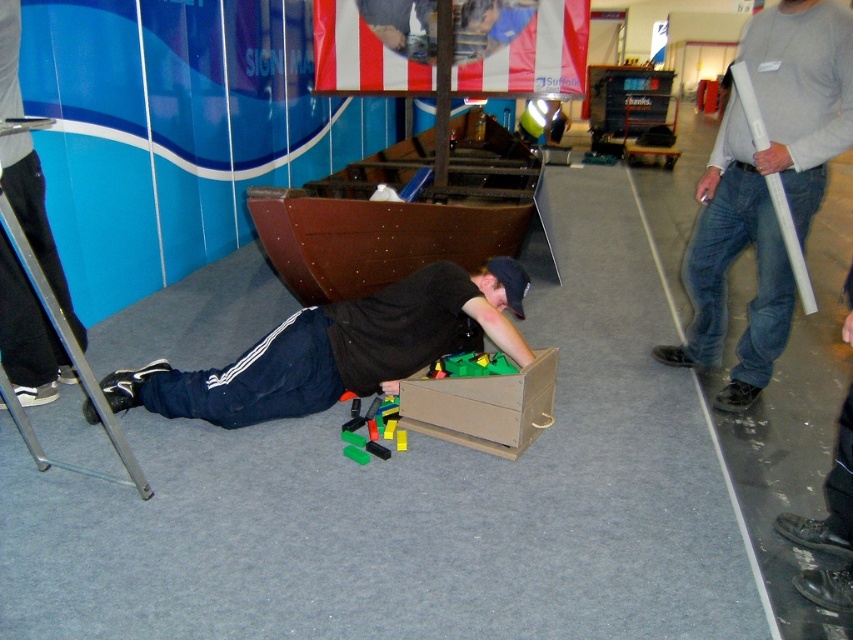
Question: Which object appears closest to the camera in this image?

Choices:
 (A) black leather shoes at lower right
 (B) green plastic blocks at center

Answer: (A)

Question: Which point is farther to the camera?

Choices:
 (A) (345, 422)
 (B) (378, 304)
 (C) (828, 516)

Answer: (B)

Question: Does black matte shirt at center have a lesser width compared to green plastic blocks at center?

Choices:
 (A) no
 (B) yes

Answer: (A)

Question: Is black matte shirt at center smaller than green plastic blocks at center?

Choices:
 (A) no
 (B) yes

Answer: (A)

Question: Observing the image, what is the correct spatial positioning of brown cardboard box at center in reference to green plastic blocks at center?

Choices:
 (A) left
 (B) right

Answer: (B)

Question: Which point appears closest to the camera in this image?

Choices:
 (A) (830, 470)
 (B) (537, 412)
 (C) (322, 348)

Answer: (A)